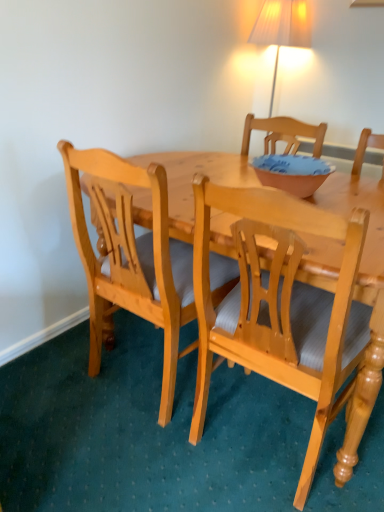
Question: Is matte pink bowl at center to the left of light wood chair at center, the second chair positioned from the left, from the viewer's perspective?

Choices:
 (A) no
 (B) yes

Answer: (A)

Question: Is the position of matte pink bowl at center more distant than that of light wood chair at center, the second chair positioned from the left?

Choices:
 (A) yes
 (B) no

Answer: (A)

Question: Does matte pink bowl at center turn towards light wood chair at center, the second chair positioned from the left?

Choices:
 (A) yes
 (B) no

Answer: (B)

Question: Is matte pink bowl at center with light wood chair at center, the second chair positioned from the left?

Choices:
 (A) no
 (B) yes

Answer: (A)

Question: Is matte pink bowl at center to the right of light wood chair at center, positioned as the 1th chair in right-to-left order, from the viewer's perspective?

Choices:
 (A) yes
 (B) no

Answer: (A)

Question: From the image's perspective, does matte pink bowl at center appear higher than light wood chair at center, positioned as the 1th chair in right-to-left order?

Choices:
 (A) no
 (B) yes

Answer: (B)

Question: Can you confirm if light wood chair at center, the second chair viewed from the right, is wider than light wood chair at center, the second chair positioned from the left?

Choices:
 (A) yes
 (B) no

Answer: (B)

Question: Is light wood chair at center, the first chair positioned from the left, turned away from light wood chair at center, the second chair positioned from the left?

Choices:
 (A) yes
 (B) no

Answer: (B)

Question: Does light wood chair at center, the first chair positioned from the left, have a greater height compared to light wood chair at center, the second chair positioned from the left?

Choices:
 (A) yes
 (B) no

Answer: (B)

Question: From a real-world perspective, is light wood chair at center, the second chair viewed from the right, on light wood chair at center, the second chair positioned from the left?

Choices:
 (A) no
 (B) yes

Answer: (B)

Question: Can you confirm if light wood chair at center, the second chair viewed from the right, is positioned to the right of light wood chair at center, positioned as the 1th chair in right-to-left order?

Choices:
 (A) yes
 (B) no

Answer: (B)

Question: Is light wood chair at center, the first chair positioned from the left, outside light wood chair at center, the second chair positioned from the left?

Choices:
 (A) no
 (B) yes

Answer: (B)

Question: Is light wood chair at center, positioned as the 1th chair in right-to-left order, with matte pink bowl at center?

Choices:
 (A) yes
 (B) no

Answer: (B)